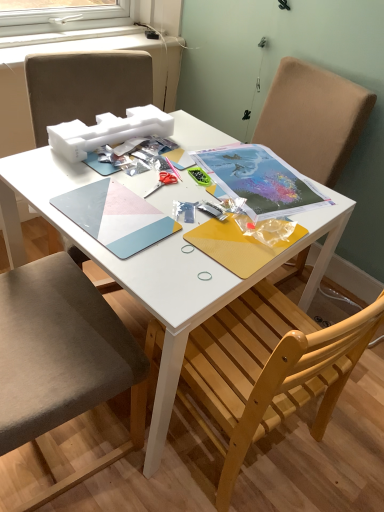
The width and height of the screenshot is (384, 512). Identify the location of free space in front of metallic silver scissors at center. click(144, 220).